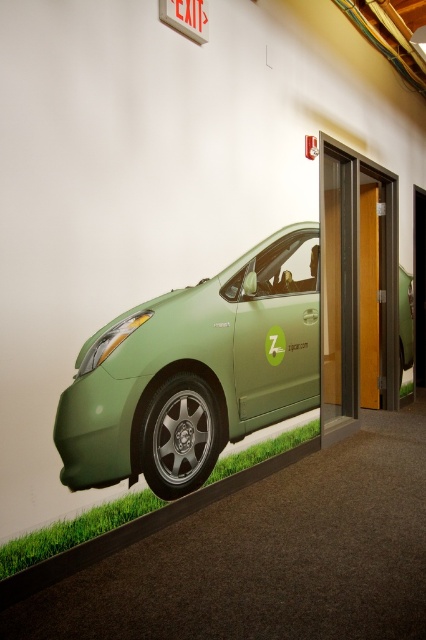
Is green matte car at lower left to the right of wooden elevator door at center from the viewer's perspective?

No, green matte car at lower left is not to the right of wooden elevator door at center.

Is point (270, 285) closer to viewer compared to point (382, 397)?

Yes, point (270, 285) is closer to viewer.

Where is `green matte car at lower left`? Image resolution: width=426 pixels, height=640 pixels. green matte car at lower left is located at coordinates (195, 371).